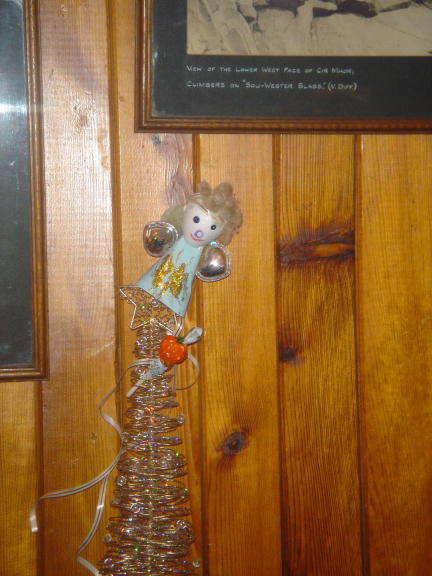
At what (x,y) coordinates should I click in order to perform the action: click on picture frame. Please return your answer as a coordinate pair (x, y). Looking at the image, I should click on (219, 104), (26, 347).